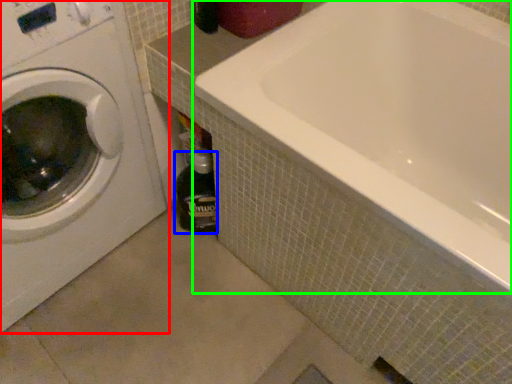
Question: Which is farther away from washing machine (highlighted by a red box)? bottle (highlighted by a blue box) or bathtub (highlighted by a green box)?

Choices:
 (A) bottle
 (B) bathtub

Answer: (B)